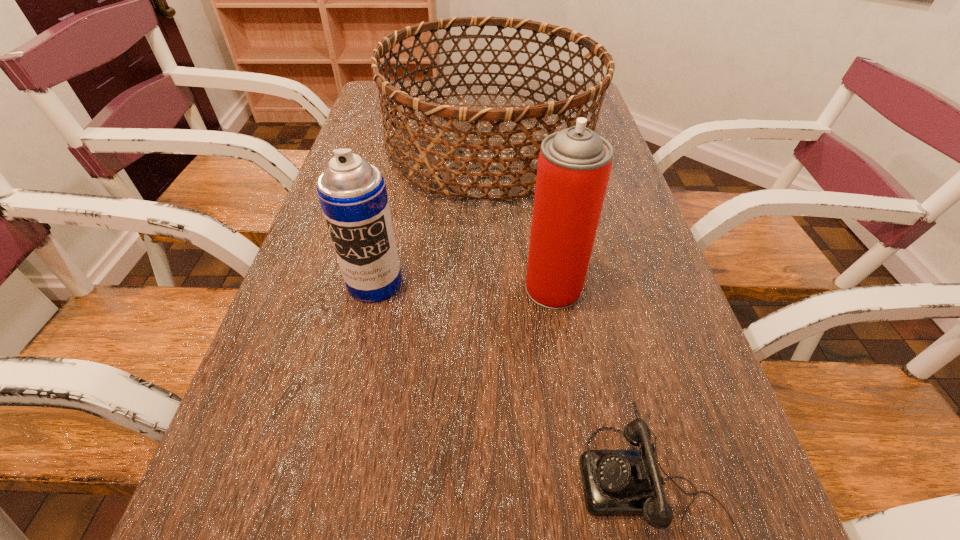
You are a GUI agent. You are given a task and a screenshot of the screen. Output one action in this format:
    pyautogui.click(x=<x>, y=<y>)
    Task: Click on the object present at the right edge
    The image size is (960, 540).
    Given the screenshot: What is the action you would take?
    pyautogui.click(x=429, y=158)

Locate an element on the screen. object that is at the far left corner is located at coordinates (429, 158).

Identify the location of object positioned at the far right corner. (429, 158).

This screenshot has height=540, width=960. I want to click on free spot at the far edge of the desktop, so click(x=510, y=90).

At what (x,y) coordinates should I click in order to perform the action: click on free space at the left edge. Please return your answer as a coordinate pair (x, y). This screenshot has width=960, height=540. Looking at the image, I should click on (360, 126).

You are a GUI agent. You are given a task and a screenshot of the screen. Output one action in this format:
    pyautogui.click(x=<x>, y=<y>)
    Task: Click on the blank space at the right edge of the desktop
    The image size is (960, 540).
    Given the screenshot: What is the action you would take?
    pyautogui.click(x=659, y=411)

This screenshot has height=540, width=960. In order to click on vacant space at the far right corner of the desktop in this screenshot , I will do `click(588, 103)`.

Locate an element on the screen. free space between the right aerosol can and the left aerosol can is located at coordinates (464, 285).

Identify the location of vacant area that lies between the shorter aerosol can and the taller aerosol can. (464, 285).

Where is `free space between the left aerosol can and the basket`? The image size is (960, 540). free space between the left aerosol can and the basket is located at coordinates (433, 216).